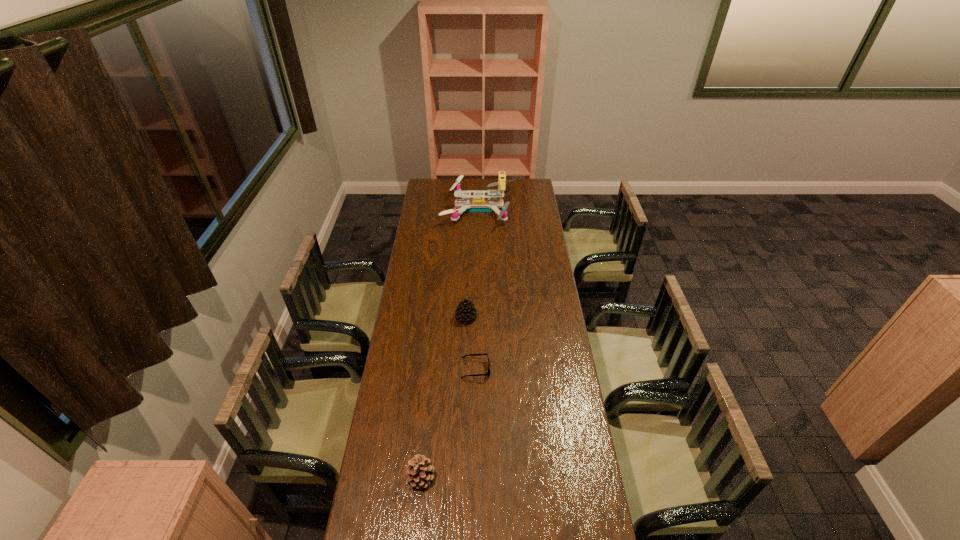
Identify which object is the nearest to the drone. Please provide its 2D coordinates. Your answer should be formatted as a tuple, i.e. [(x, y)], where the tuple contains the x and y coordinates of a point satisfying the conditions above.

[(465, 312)]

Point out which object is positioned as the third nearest to the second farthest object. Please provide its 2D coordinates. Your answer should be formatted as a tuple, i.e. [(x, y)], where the tuple contains the x and y coordinates of a point satisfying the conditions above.

[(419, 473)]

This screenshot has height=540, width=960. I want to click on vacant space that satisfies the following two spatial constraints: 1. on the front-facing side of the tallest object; 2. at the narrow end of the second farthest object, so click(x=479, y=318).

Where is `free location that satisfies the following two spatial constraints: 1. on the front-facing side of the drone; 2. on the front side of the left pinecone`? free location that satisfies the following two spatial constraints: 1. on the front-facing side of the drone; 2. on the front side of the left pinecone is located at coordinates (478, 477).